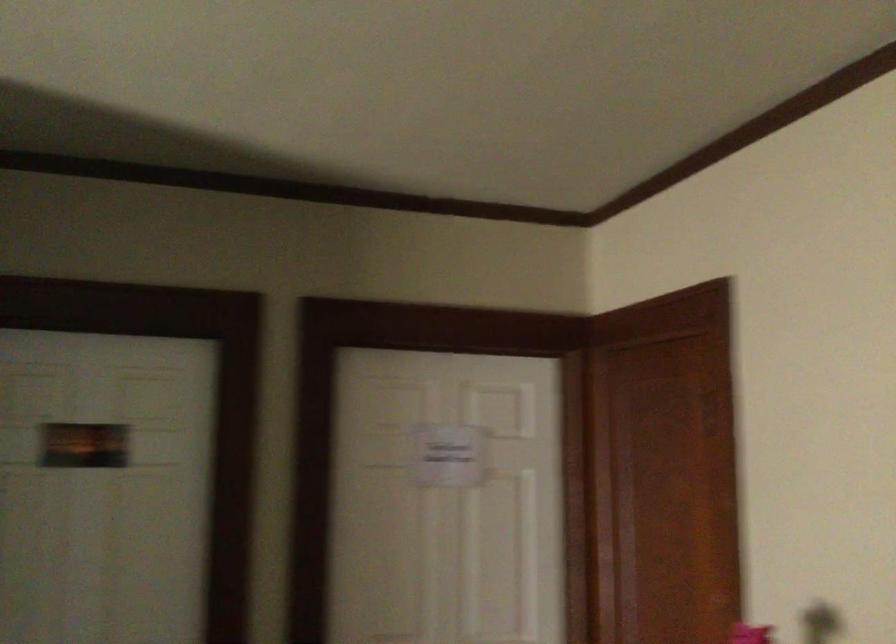
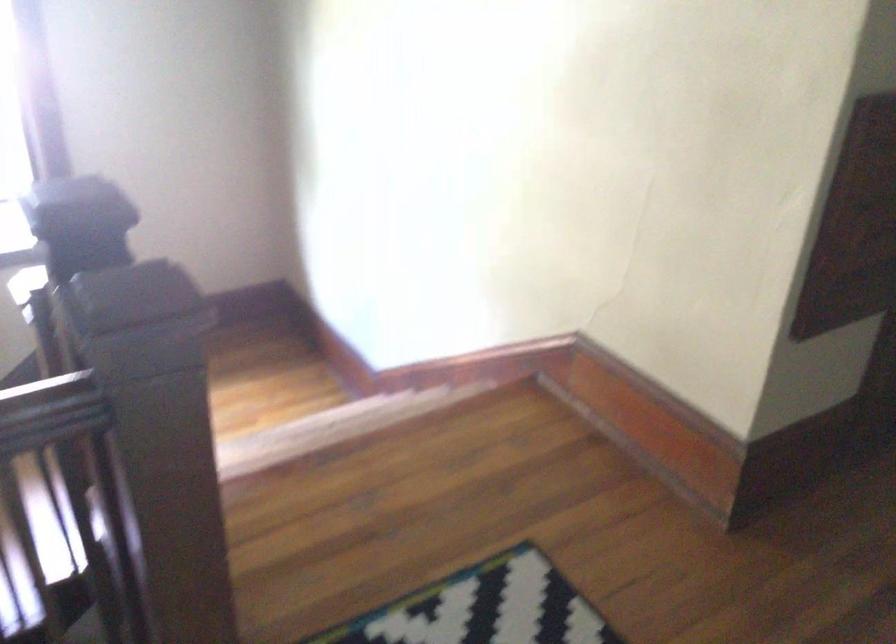
The images are taken continuously from a first-person perspective. In which direction is your viewpoint rotating?

The rotation direction of the camera is left-down.